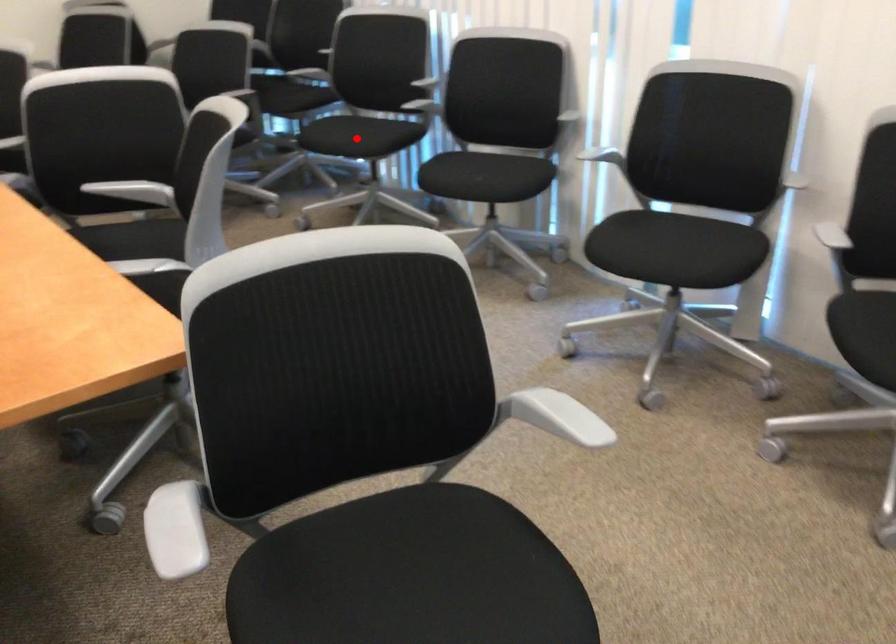
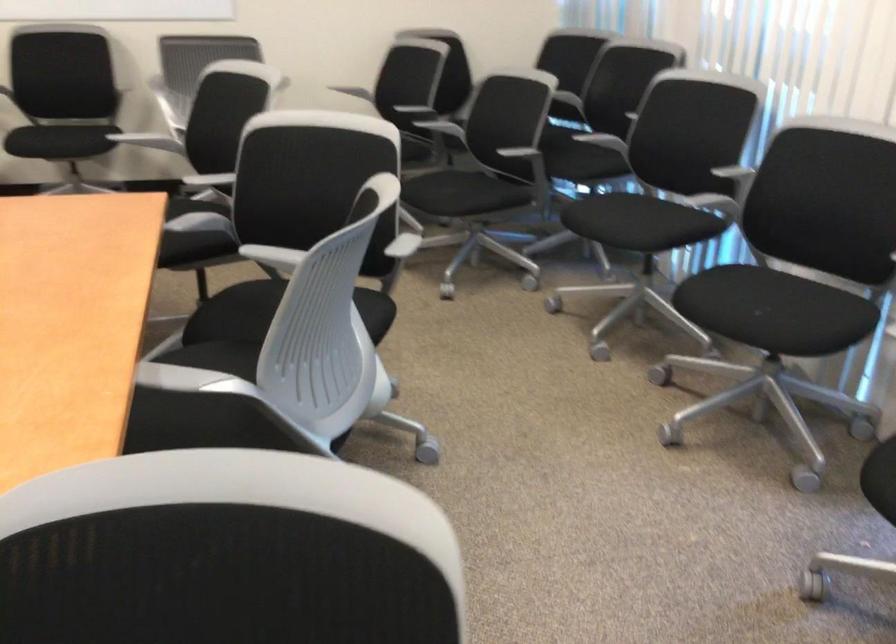
Question: A red point is marked in image1. In image2, is the corresponding 3D point closer to the camera or farther? Reply with the corresponding letter.

Choices:
 (A) The corresponding 3D point is closer.
 (B) The corresponding 3D point is farther.

Answer: (A)